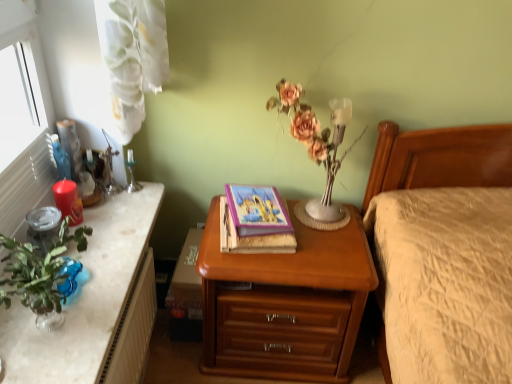
Identify the location of vacant space in front of silver metallic candle holder at upper left. (125, 211).